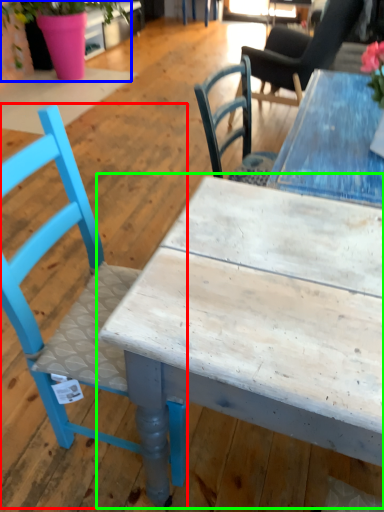
Question: Based on their relative distances, which object is farther from chair (highlighted by a red box)? Choose from houseplant (highlighted by a blue box) and table (highlighted by a green box).

Choices:
 (A) houseplant
 (B) table

Answer: (A)